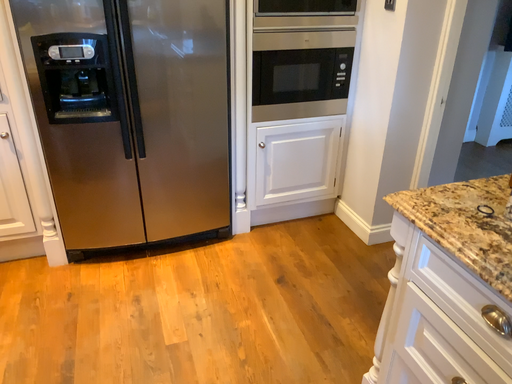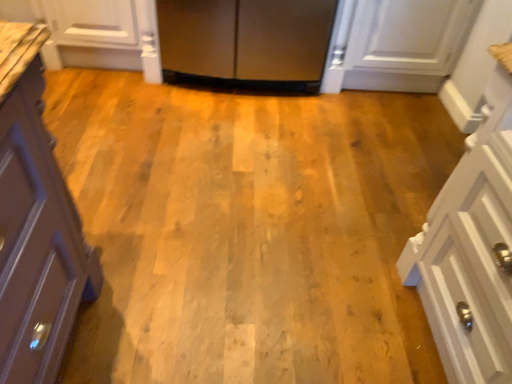
Question: How did the camera likely rotate when shooting the video?

Choices:
 (A) rotated left
 (B) rotated right

Answer: (A)